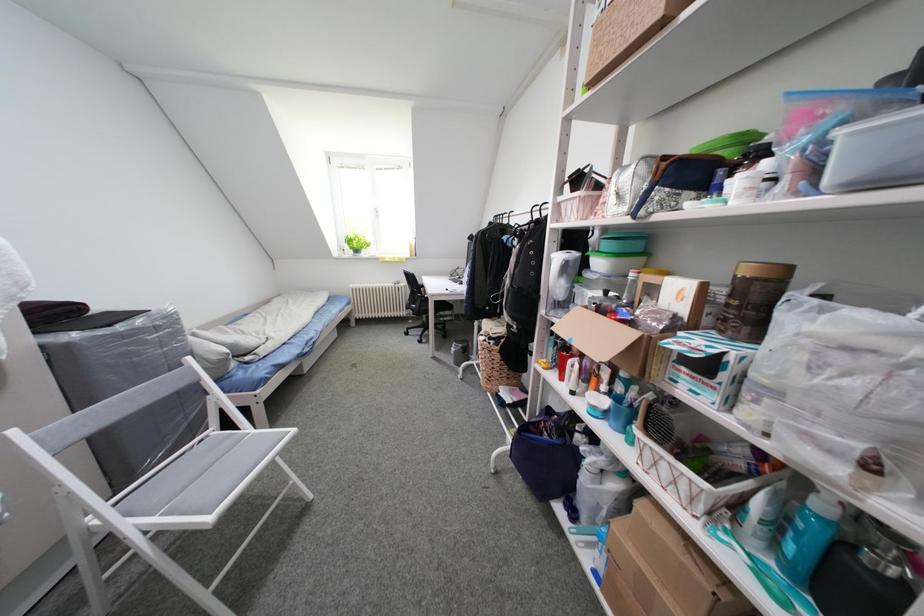
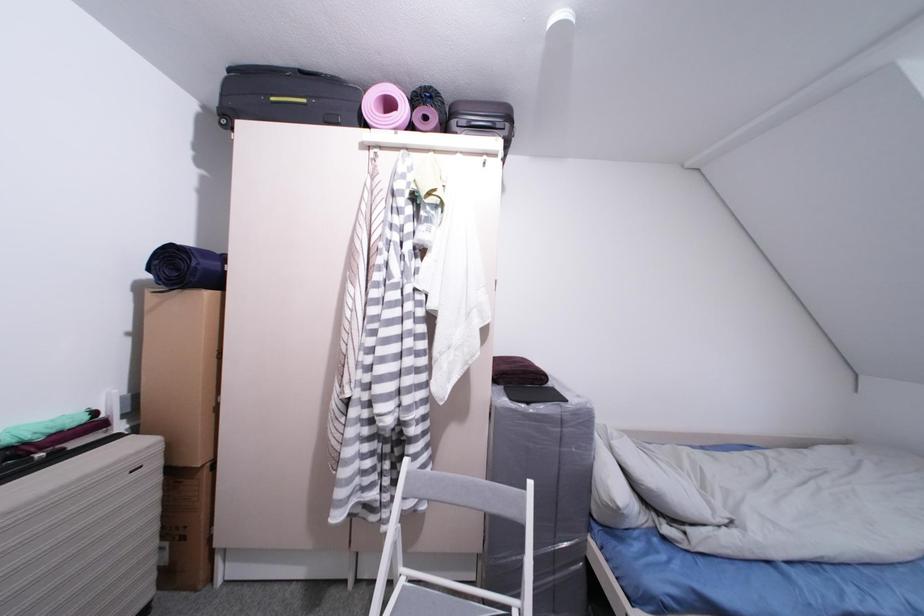
Question: The camera is either moving clockwise (left) or counter-clockwise (right) around the object. The first image is from the beginning of the video and the second image is from the end. Is the camera moving left or right when shooting the video?

Choices:
 (A) Left
 (B) Right

Answer: (B)